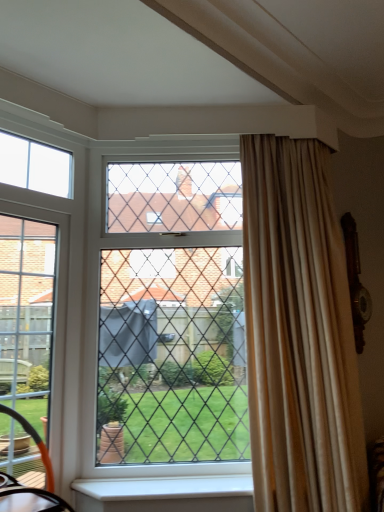
I want to click on vacant space situated above white smooth window sill at lower center (from a real-world perspective), so click(x=183, y=476).